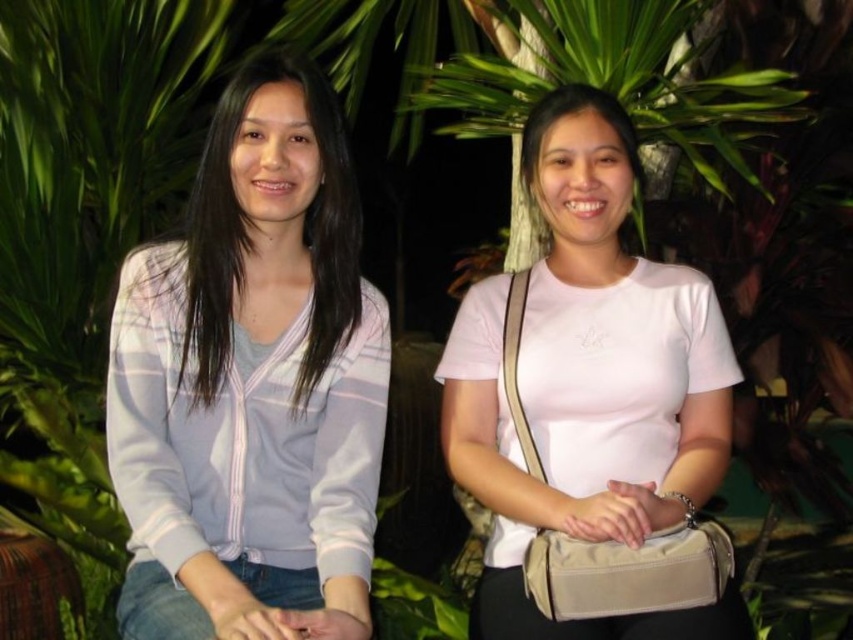
Question: In this image, where is pink matte shirt at center located relative to white matte shirt at center?

Choices:
 (A) above
 (B) below

Answer: (B)

Question: Which of the following is the closest to the observer?

Choices:
 (A) (637, 205)
 (B) (701, 362)

Answer: (B)

Question: Does pink matte shirt at center have a lesser width compared to white matte shirt at center?

Choices:
 (A) yes
 (B) no

Answer: (B)

Question: Which object is closer to the camera taking this photo?

Choices:
 (A) light purple striped cardigan at left
 (B) white matte shirt at center
 (C) pink matte shirt at center

Answer: (A)

Question: Can you confirm if light purple striped cardigan at left is wider than white matte shirt at center?

Choices:
 (A) yes
 (B) no

Answer: (A)

Question: Which object is closer to the camera taking this photo?

Choices:
 (A) light purple striped cardigan at left
 (B) pink matte shirt at center

Answer: (A)